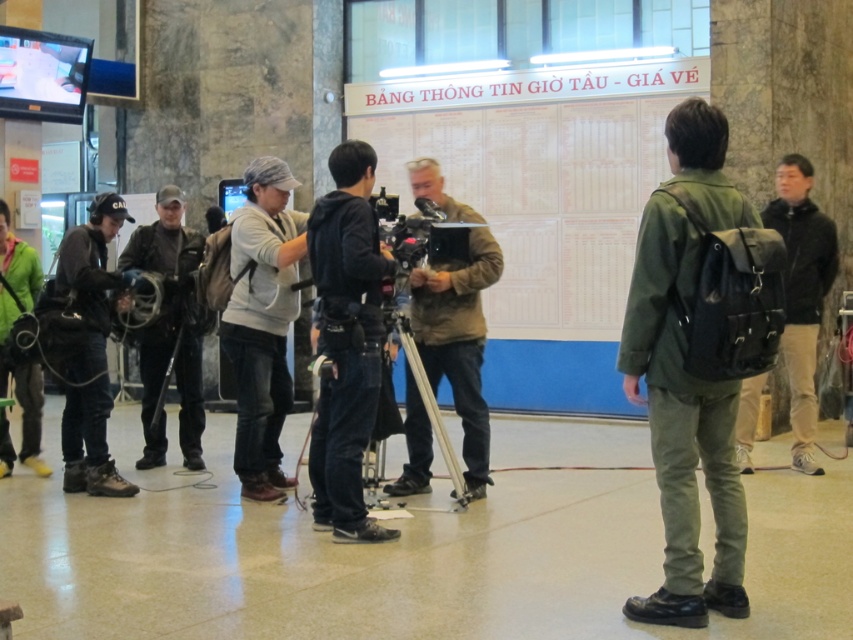
From the picture: You are a photographer standing in the scene and want to take a photo of both the point at (711,476) and the point at (482,404). Which point will appear larger in your photo?

The point at (711,476) will appear larger in the photo because it is closer to the viewer than the point at (482,404).

You are a delivery person carrying a box that is 2 meters long. You need to move from the green fabric jacket at left to the black matte backpack at right. Can you pass through the space between them without tilting the box?

The distance between the black matte backpack at right and green fabric jacket at left is 5.55 meters, so yes, the delivery person can pass through the space between them without tilting the box since the distance is greater than the box length.